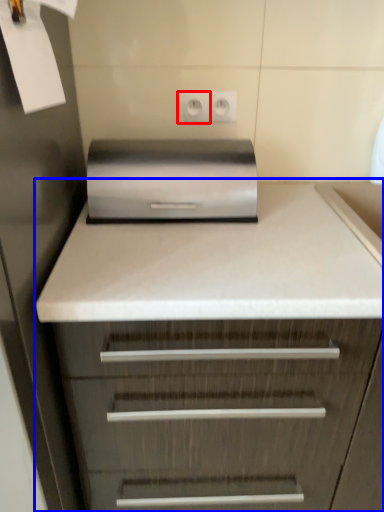
Question: Which object appears farthest to the camera in this image, electric outlet (highlighted by a red box) or chest of drawers (highlighted by a blue box)?

Choices:
 (A) electric outlet
 (B) chest of drawers

Answer: (A)